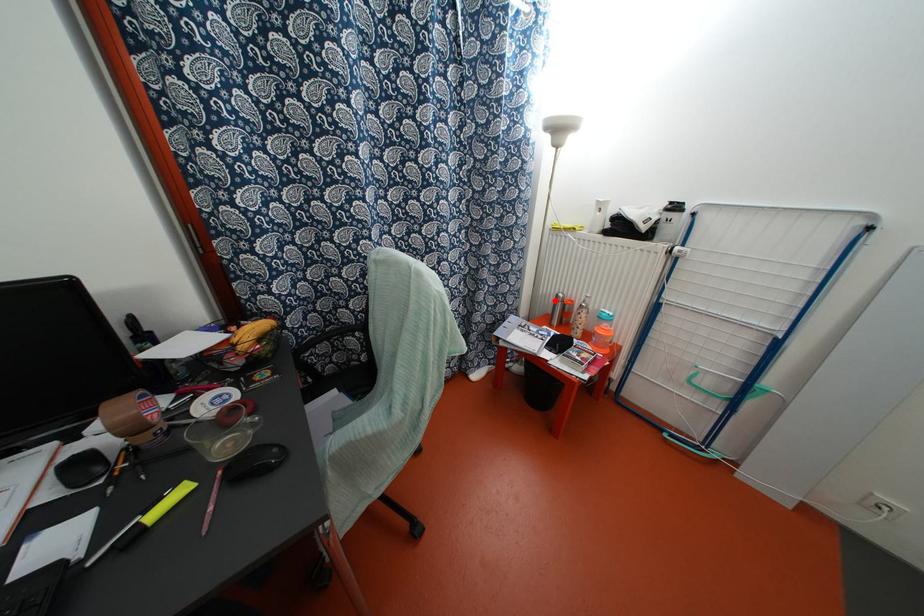
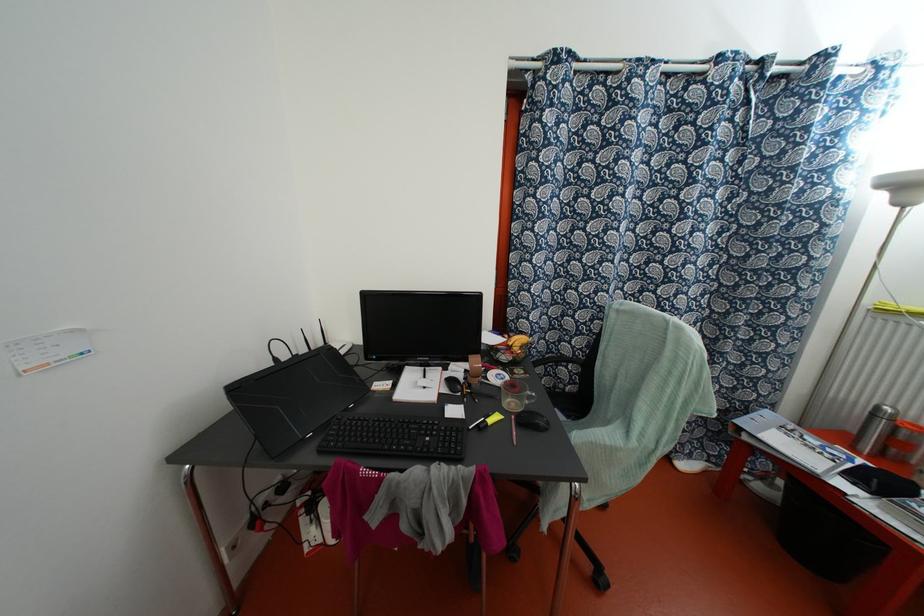
Question: I am providing you with two images of the same scene from different viewpoints. Image1 has a red point marked. In image2, the corresponding 3D location appears at what relative position? Reply with the corresponding letter.

Choices:
 (A) Closer
 (B) Farther

Answer: (B)